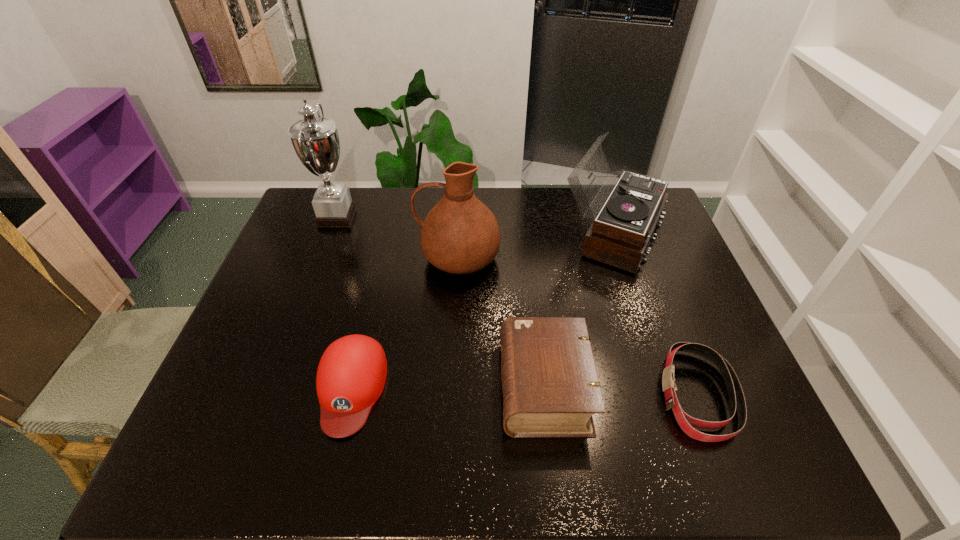
The width and height of the screenshot is (960, 540). What are the coordinates of `trophy cup` in the screenshot? It's located at [315, 140].

Locate an element on the screen. This screenshot has height=540, width=960. the tallest object is located at coordinates point(315,140).

The image size is (960, 540). In order to click on the fifth shortest object in this screenshot , I will do `click(460, 235)`.

Where is `record player`? The height and width of the screenshot is (540, 960). record player is located at coordinates (619, 236).

Find the location of a particular element. The width and height of the screenshot is (960, 540). Bible is located at coordinates (550, 384).

Where is `baseball cap`? This screenshot has width=960, height=540. baseball cap is located at coordinates (351, 375).

Find the location of a particular element. This screenshot has width=960, height=540. the shortest object is located at coordinates (736, 396).

At what (x,y) coordinates should I click in order to perform the action: click on free location located 0.070m at the front view of the leftmost object. Please return your answer as a coordinate pair (x, y). This screenshot has height=540, width=960. Looking at the image, I should click on click(378, 217).

This screenshot has width=960, height=540. In order to click on free point located on the side of the pitcher with the handle in this screenshot , I will do pos(321,258).

Where is `vacant space located 0.070m on the side of the pitcher with the handle`? This screenshot has height=540, width=960. vacant space located 0.070m on the side of the pitcher with the handle is located at coordinates (395, 258).